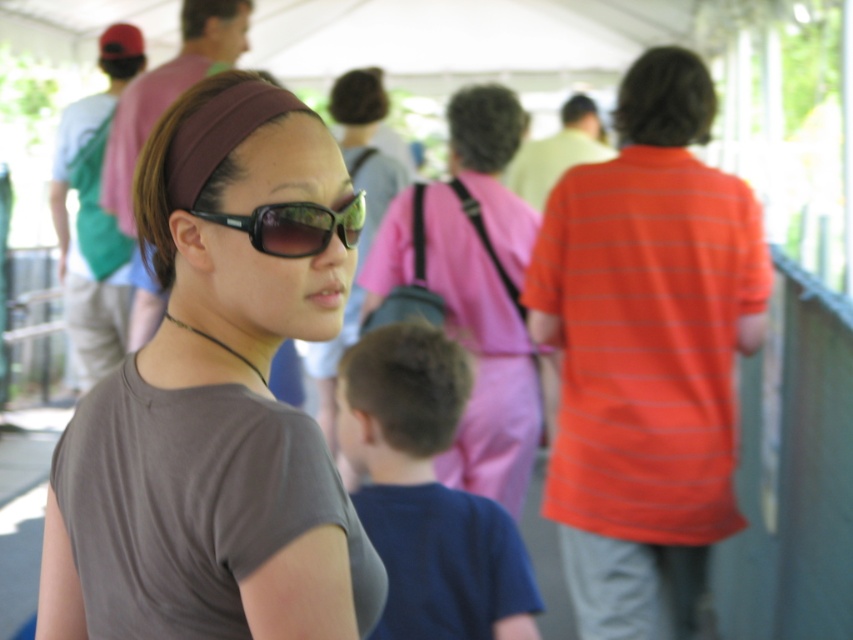
Question: Observing the image, what is the correct spatial positioning of blue cotton shirt at center in reference to black plastic sunglasses at center?

Choices:
 (A) right
 (B) left

Answer: (A)

Question: Which point is farther from the camera taking this photo?

Choices:
 (A) (318, 230)
 (B) (338, 410)
 (C) (474, 298)
 (D) (575, 465)

Answer: (B)

Question: Among these objects, which one is nearest to the camera?

Choices:
 (A) pink fabric dress at center
 (B) matte brown headband at center
 (C) orange striped shirt at right
 (D) black plastic sunglasses at center

Answer: (B)

Question: In this image, where is matte brown headband at center located relative to black plastic sunglasses at center?

Choices:
 (A) above
 (B) below

Answer: (B)

Question: Is blue cotton shirt at center below black plastic sunglasses at center?

Choices:
 (A) no
 (B) yes

Answer: (B)

Question: Which is nearer to the matte brown headband at center?

Choices:
 (A) pink fabric dress at center
 (B) orange striped shirt at right
 (C) black plastic sunglasses at center

Answer: (C)